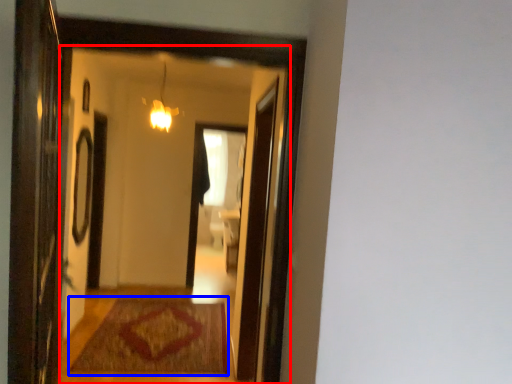
Question: Which object appears closest to the camera in this image, mirror (highlighted by a red box) or mat (highlighted by a blue box)?

Choices:
 (A) mirror
 (B) mat

Answer: (A)